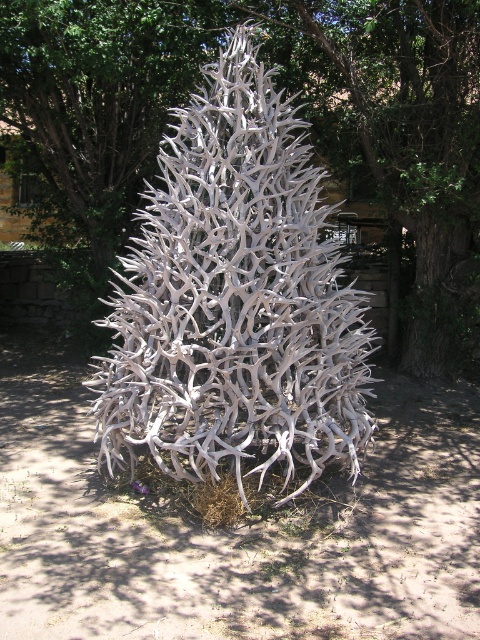
You are standing in front of the antler sculpture and want to take a photo. You notice two points on the sculpture marked at coordinates point (192, 369) and point (360, 60). Which point will appear larger in your camera view?

Point (192, 369) is closer to the camera than point (360, 60), so it will appear larger in the camera view.

You are standing at the center of the image and want to place a small decoration exactly at the base of the white antler christmas tree at center. According to the coordinates provided, where should you aim to place the decoration?

The white antler christmas tree at center is located at point (235, 301), so you should aim for those coordinates to place the decoration at its base.